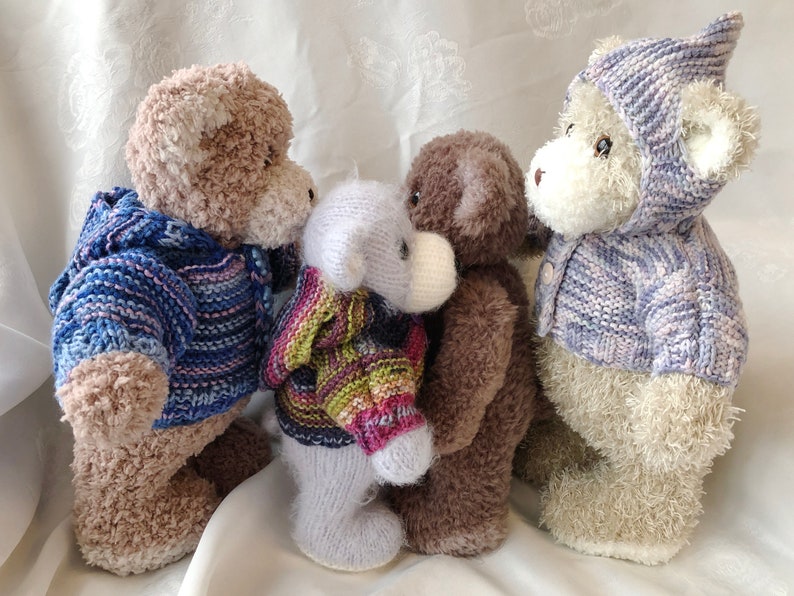
Image resolution: width=794 pixels, height=596 pixels. In order to click on teddy bear in this screenshot , I will do `click(202, 524)`, `click(478, 340)`, `click(592, 383)`, `click(368, 339)`, `click(198, 297)`.